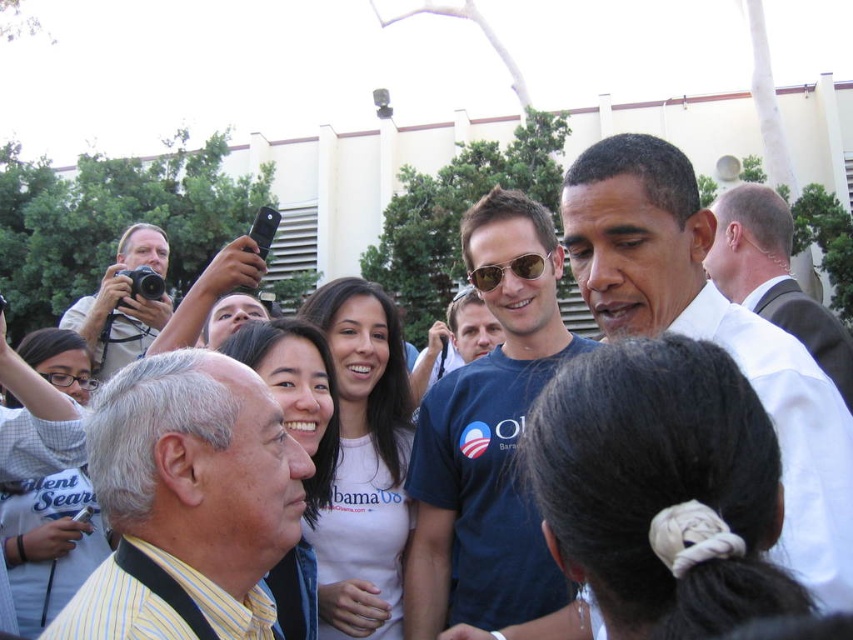
From the picture: Is yellow striped shirt at center bigger than matte black camera at upper left?

No.

In the scene shown: Is yellow striped shirt at center positioned before matte black camera at upper left?

Yes, it is in front of matte black camera at upper left.

Which is behind, point (122, 579) or point (90, 336)?

The point (90, 336) is more distant.

Locate an element on the screen. The height and width of the screenshot is (640, 853). yellow striped shirt at center is located at coordinates (200, 480).

What do you see at coordinates (122, 304) in the screenshot?
I see `matte black camera at upper left` at bounding box center [122, 304].

Does matte black camera at upper left lie in front of sunglasses at center?

No.

Does point (62, 324) lie in front of point (537, 275)?

That is False.

The width and height of the screenshot is (853, 640). What are the coordinates of `matte black camera at upper left` in the screenshot? It's located at (122, 304).

From the picture: Does yellow striped shirt at center come in front of white shirt at center?

No, it is not.

Between yellow striped shirt at center and white shirt at center, which one is positioned higher?

white shirt at center is higher up.

Identify the location of yellow striped shirt at center. (200, 480).